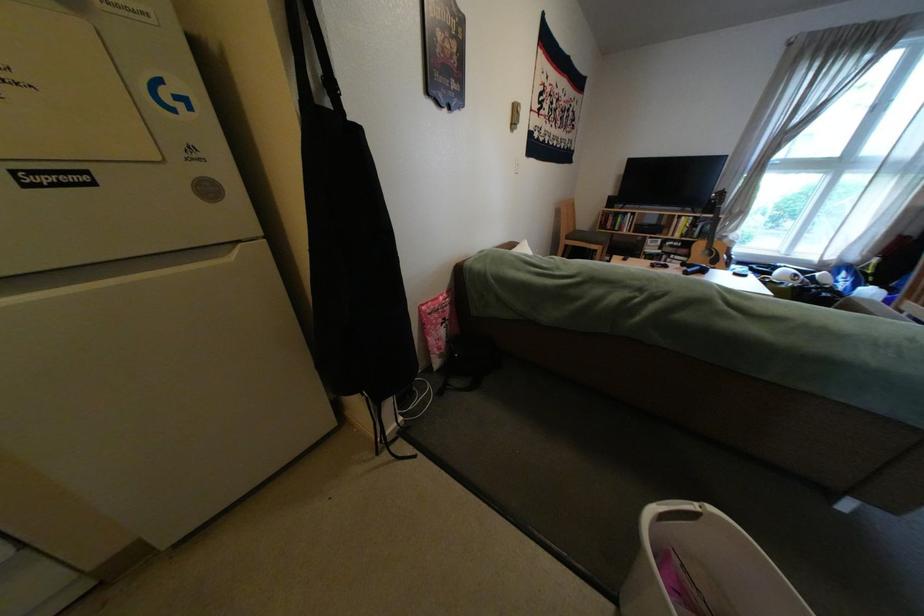
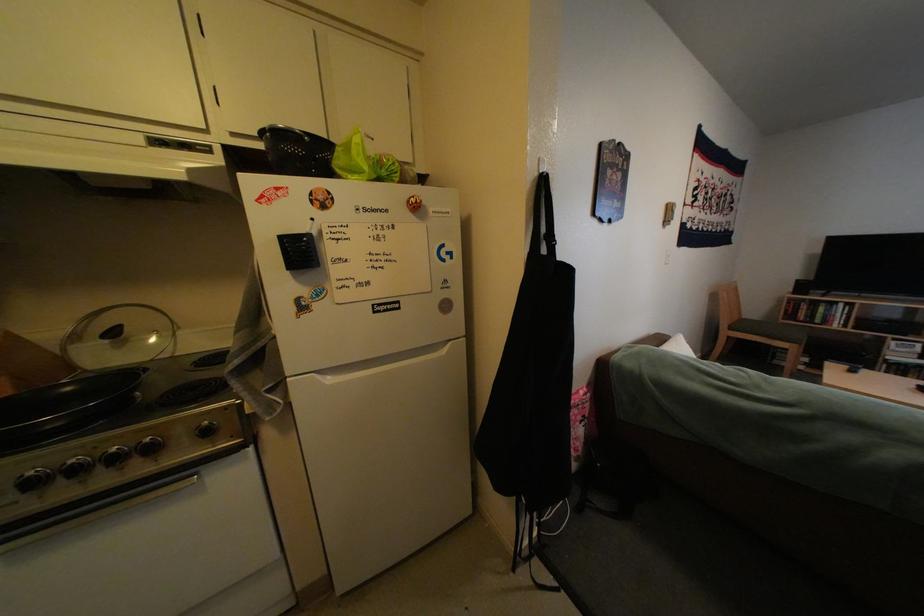
Find the pixel in the second image that matches [378,394] in the first image.

(538, 499)